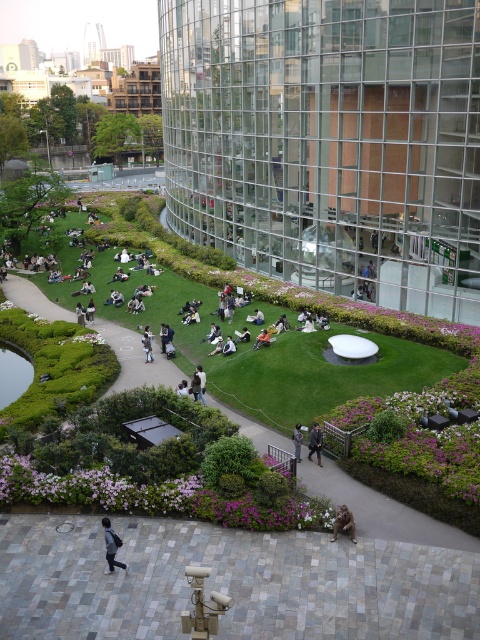
Question: Based on their relative distances, which object is farther from the gray fabric jacket at center?

Choices:
 (A) green grassy park at center
 (B) dark gray sweater at center
 (C) brown fur monkey at lower center
 (D) dark gray fabric jacket at lower left

Answer: (A)

Question: Does dark gray fabric jacket at lower left appear under gray fabric jacket at center?

Choices:
 (A) yes
 (B) no

Answer: (A)

Question: Which point is farther to the camera?

Choices:
 (A) (360, 308)
 (B) (313, 436)
 (C) (109, 520)

Answer: (A)

Question: Can you confirm if green grassy park at center is positioned to the right of gray fabric jacket at center?

Choices:
 (A) yes
 (B) no

Answer: (B)

Question: Which object is the closest to the brown fur monkey at lower center?

Choices:
 (A) green grassy park at center
 (B) dark gray sweater at center
 (C) dark gray fabric jacket at lower left

Answer: (B)

Question: Does dark gray fabric jacket at lower left have a lesser width compared to brown fur monkey at lower center?

Choices:
 (A) no
 (B) yes

Answer: (B)